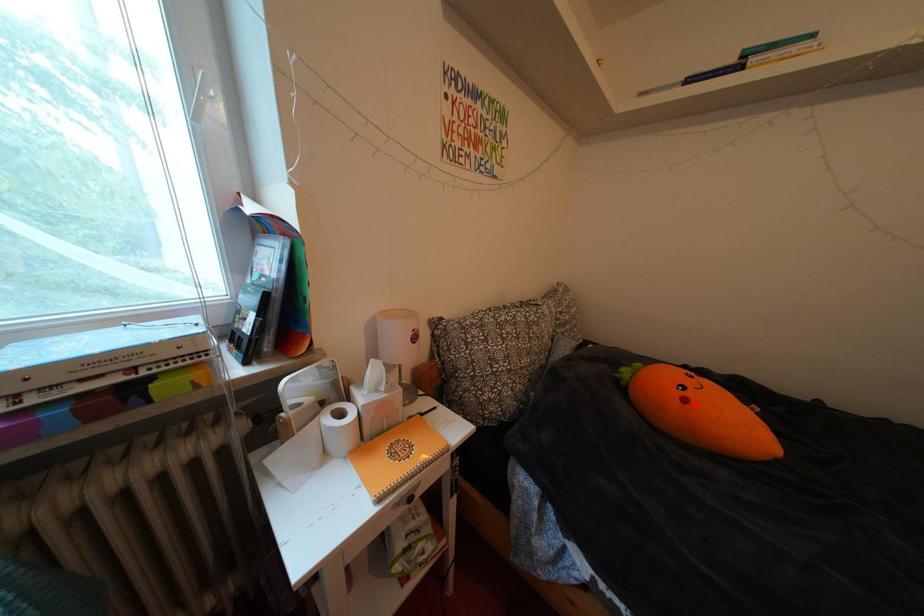
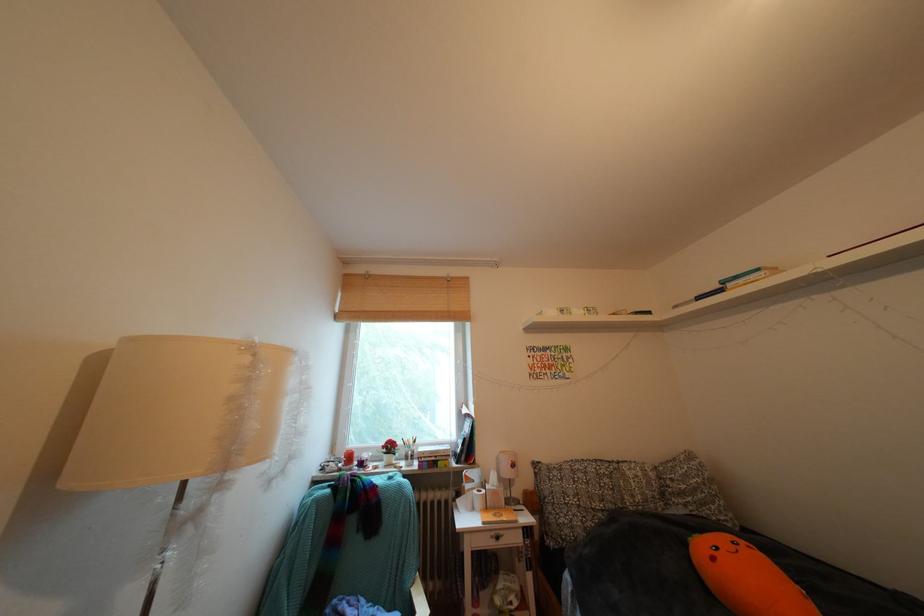
Question: I am providing you with two images of the same scene from different viewpoints. A red point is marked on the first image. Is the red point's position out of view in image 2?

Choices:
 (A) Yes
 (B) No

Answer: (B)